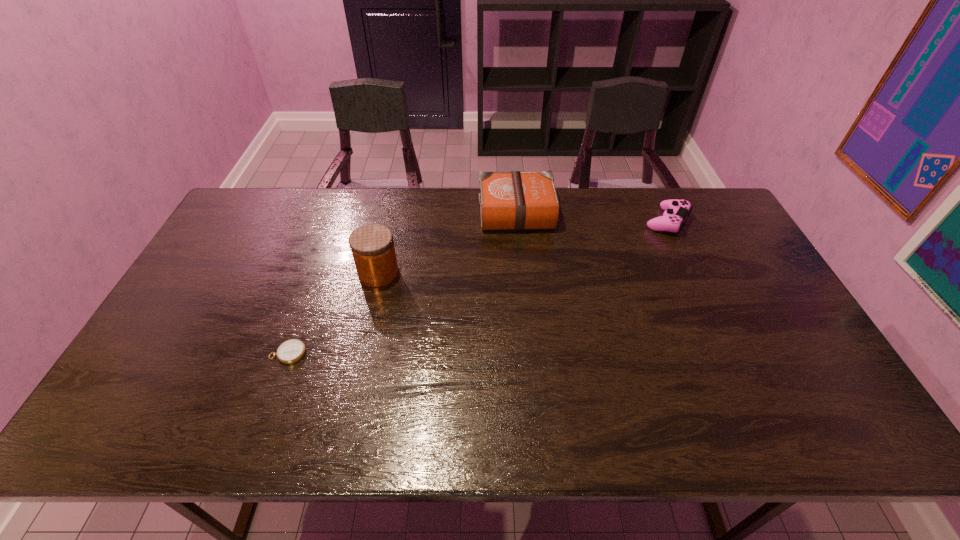
The height and width of the screenshot is (540, 960). I want to click on free spot between the third shortest object and the control, so [592, 217].

Choose which object is the second nearest neighbor to the rightmost object. Please provide its 2D coordinates. Your answer should be formatted as a tuple, i.e. [(x, y)], where the tuple contains the x and y coordinates of a point satisfying the conditions above.

[(372, 246)]

Identify which object is the closest to the Bible. Please provide its 2D coordinates. Your answer should be formatted as a tuple, i.e. [(x, y)], where the tuple contains the x and y coordinates of a point satisfying the conditions above.

[(372, 246)]

Locate an element on the screen. Image resolution: width=960 pixels, height=540 pixels. vacant space that satisfies the following two spatial constraints: 1. on the back side of the compass; 2. on the right side of the second object from right to left is located at coordinates (339, 211).

I want to click on free spot that satisfies the following two spatial constraints: 1. on the back side of the control; 2. on the left side of the third farthest object, so click(x=391, y=221).

What are the coordinates of `vacant position in the image that satisfies the following two spatial constraints: 1. on the back side of the second tallest object; 2. on the left side of the second nearest object` in the screenshot? It's located at (393, 211).

Where is `free point that satisfies the following two spatial constraints: 1. on the back side of the third tallest object; 2. on the right side of the shortest object`? This screenshot has height=540, width=960. free point that satisfies the following two spatial constraints: 1. on the back side of the third tallest object; 2. on the right side of the shortest object is located at coordinates (335, 221).